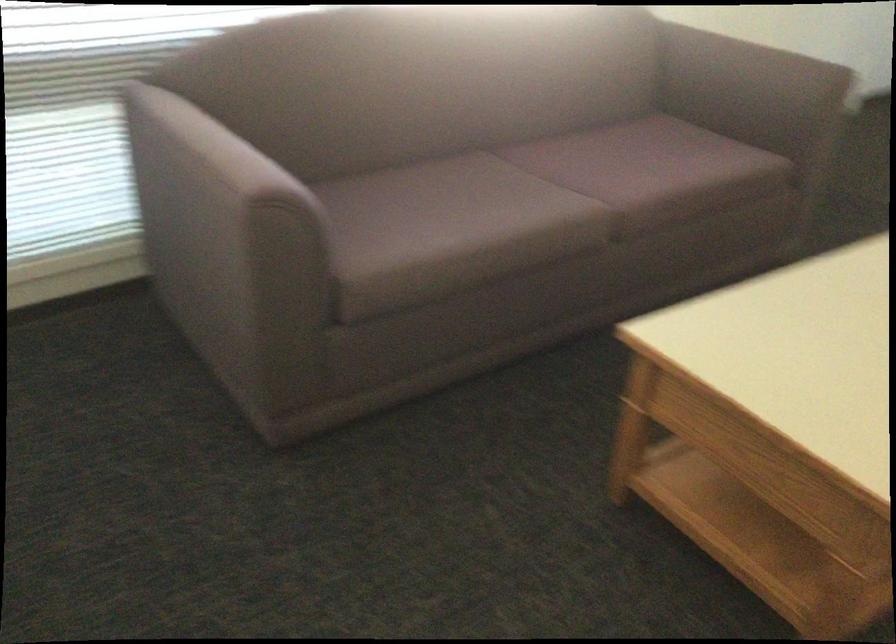
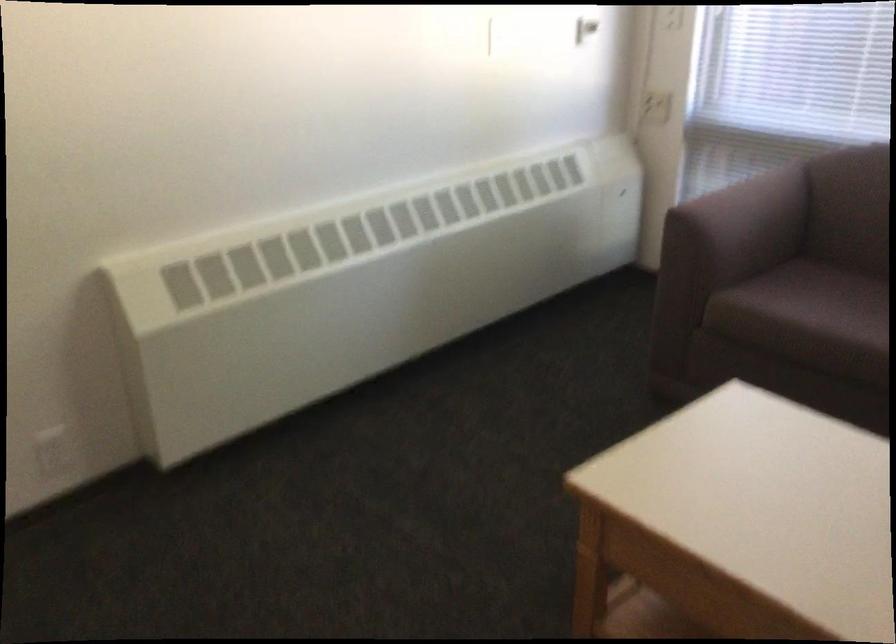
Where in the second image is the point corresponding to pixel 247 154 from the first image?

(752, 207)